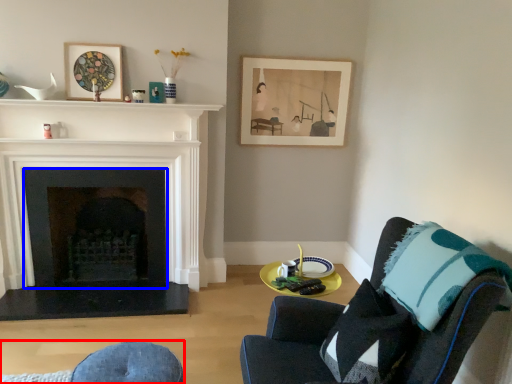
Question: Which point is further to the camera, swivel chair (highlighted by a red box) or fireplace (highlighted by a blue box)?

Choices:
 (A) swivel chair
 (B) fireplace

Answer: (B)